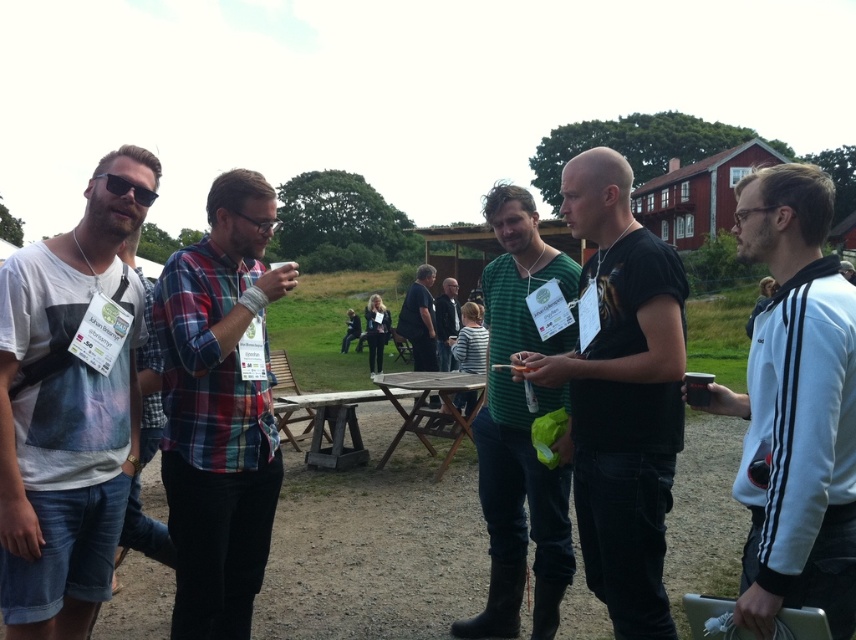
You are standing at the origin point in the image and want to find the green striped shirt at center. In which direction should you look to locate it?

The green striped shirt at center is located at point 0.672 in the x coordinate and 0.609 in the y coordinate. Since the origin is at the bottom left corner, you should look to the upper right direction to find it.

You are standing in the middle of the grassy field and want to sit down at the wooden picnic table at center. Which direction should you move relative to the green textured shirt at center?

You should move to the right of the green textured shirt at center to reach the wooden picnic table at center.